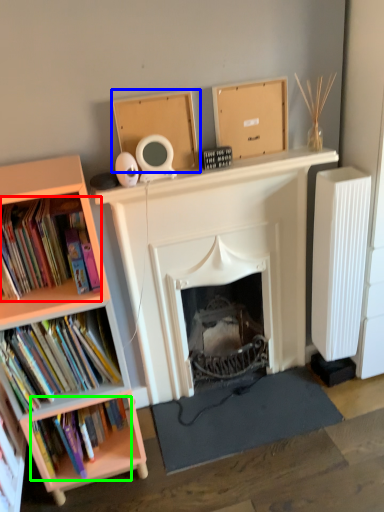
Question: Based on their relative distances, which object is farther from book (highlighted by a red box)? Choose from cardboard box (highlighted by a blue box) and book (highlighted by a green box).

Choices:
 (A) cardboard box
 (B) book

Answer: (B)